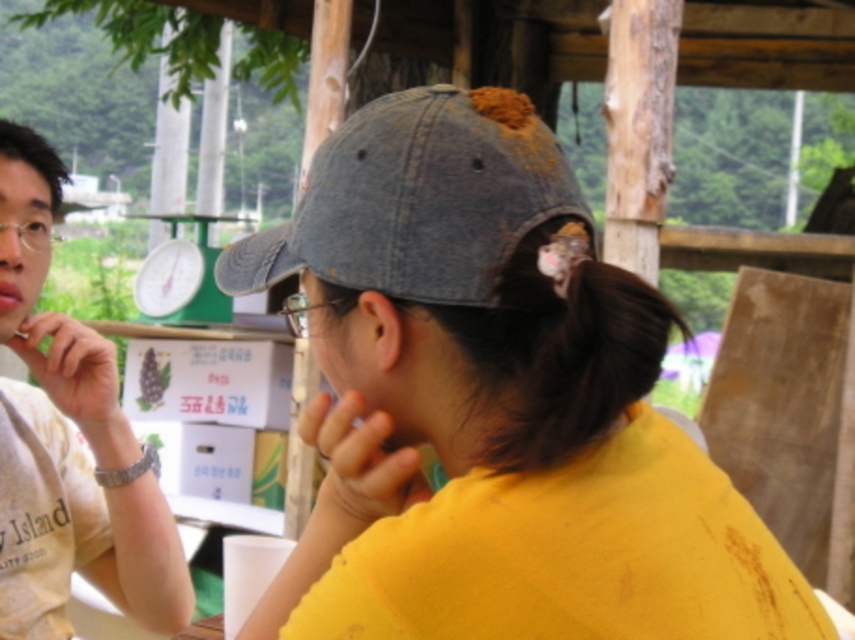
Question: Where is denim cap at center located in relation to pink matte lips at center in the image?

Choices:
 (A) above
 (B) below

Answer: (B)

Question: Which point is closer to the camera?

Choices:
 (A) denim cap at center
 (B) light brown wooden table at left
 (C) denim baseball cap at center
 (D) pink matte lips at center

Answer: (A)

Question: Is denim cap at center behind denim baseball cap at center?

Choices:
 (A) yes
 (B) no

Answer: (B)

Question: Considering the real-world distances, which object is farthest from the light brown wooden table at left?

Choices:
 (A) denim baseball cap at center
 (B) pink matte lips at center
 (C) denim cap at center

Answer: (C)

Question: Which of the following is the farthest from the observer?

Choices:
 (A) pink matte lips at center
 (B) denim baseball cap at center
 (C) light brown wooden table at left

Answer: (A)

Question: Can you confirm if denim baseball cap at center is positioned to the left of light brown wooden table at left?

Choices:
 (A) yes
 (B) no

Answer: (B)